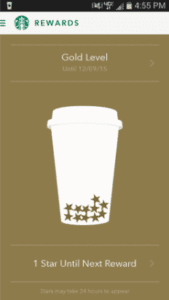
Identify the location of cup. The image size is (169, 300). (81, 137).